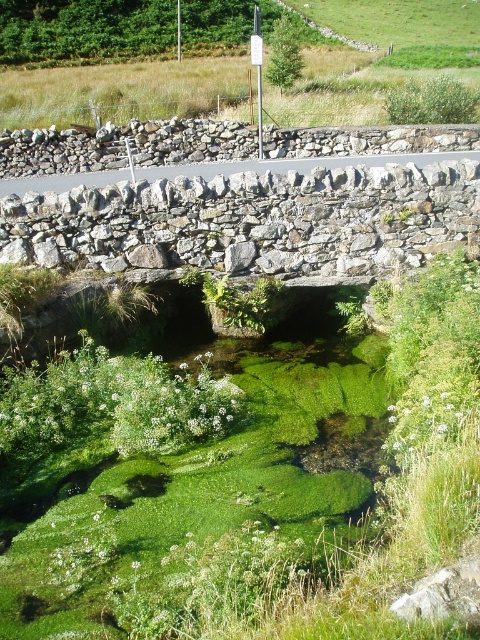
Question: From the image, what is the correct spatial relationship of gray rough stone bridge at center in relation to gray rough stone at center?

Choices:
 (A) left
 (B) right

Answer: (B)

Question: Which of the following is the closest to the observer?

Choices:
 (A) (264, 128)
 (B) (453, 225)

Answer: (B)

Question: Which point is closer to the camera?

Choices:
 (A) (60, 195)
 (B) (420, 141)

Answer: (A)

Question: Observing the image, what is the correct spatial positioning of gray rough stone bridge at center in reference to gray rough stone at center?

Choices:
 (A) right
 (B) left

Answer: (A)

Question: Can you confirm if gray rough stone bridge at center is positioned to the left of gray rough stone at center?

Choices:
 (A) no
 (B) yes

Answer: (A)